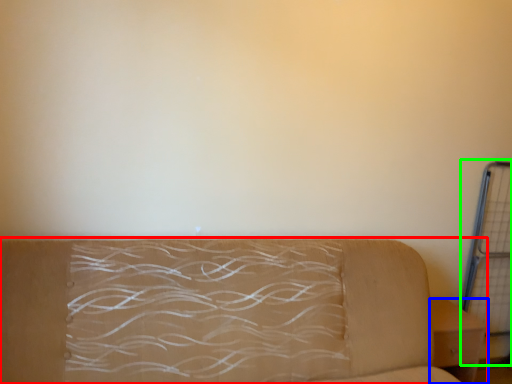
Question: Estimate the real-world distances between objects in this image. Which object is closer to studio couch (highlighted by a red box), furniture (highlighted by a blue box) or cage (highlighted by a green box)?

Choices:
 (A) furniture
 (B) cage

Answer: (A)